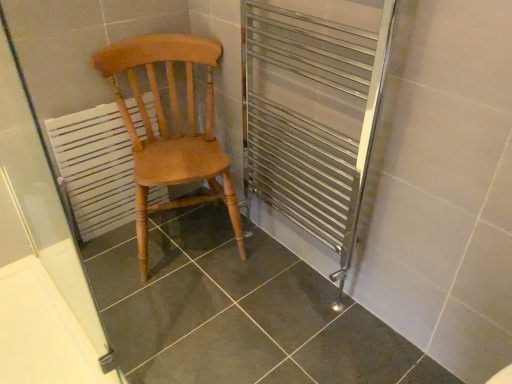
Where is `vacant space in front of white painted wood radiator at left`? The width and height of the screenshot is (512, 384). vacant space in front of white painted wood radiator at left is located at coordinates (112, 258).